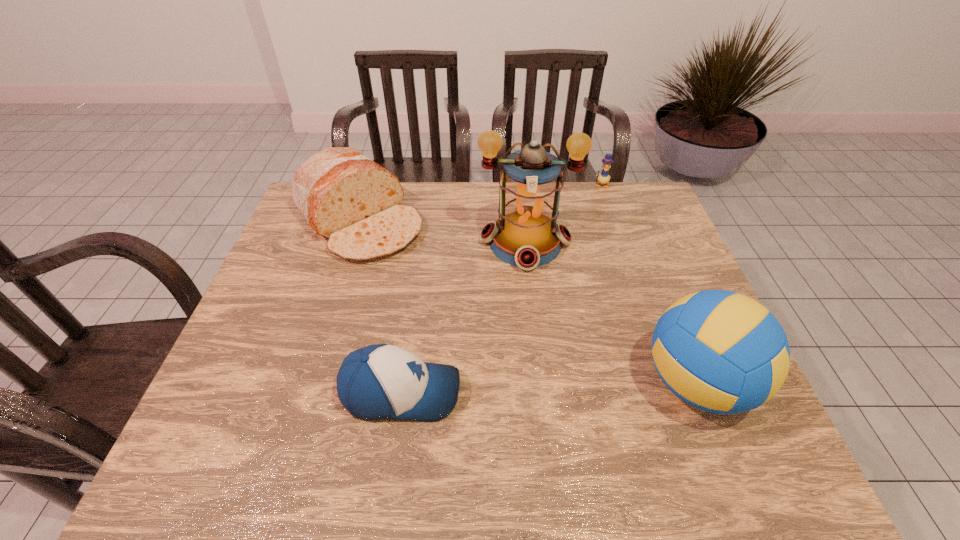
At what (x,y) coordinates should I click in order to perform the action: click on baseball cap. Please return your answer as a coordinate pair (x, y). Looking at the image, I should click on (382, 381).

At what (x,y) coordinates should I click in order to perform the action: click on the second tallest object. Please return your answer as a coordinate pair (x, y). Looking at the image, I should click on (722, 352).

Locate an element on the screen. The height and width of the screenshot is (540, 960). lantern is located at coordinates (526, 235).

Find the location of `the tallest object`. the tallest object is located at coordinates (526, 235).

You are a GUI agent. You are given a task and a screenshot of the screen. Output one action in this format:
    pyautogui.click(x=<x>, y=<y>)
    Task: Click on the third tallest object
    The width and height of the screenshot is (960, 540).
    Given the screenshot: What is the action you would take?
    pyautogui.click(x=346, y=197)

Locate an element on the screen. The height and width of the screenshot is (540, 960). duckling is located at coordinates (603, 178).

At what (x,y) coordinates should I click in order to perform the action: click on vacant space located on the front-facing side of the baseball cap. Please return your answer as a coordinate pair (x, y). This screenshot has height=540, width=960. Looking at the image, I should click on (564, 392).

Locate an element on the screen. The image size is (960, 540). free space located 0.060m on the left of the fourth shortest object is located at coordinates (613, 383).

The image size is (960, 540). I want to click on blank area located 0.290m on the front-facing side of the third object from right to left, so click(x=528, y=362).

Locate an element on the screen. The width and height of the screenshot is (960, 540). vacant space located on the front-facing side of the third object from right to left is located at coordinates (528, 366).